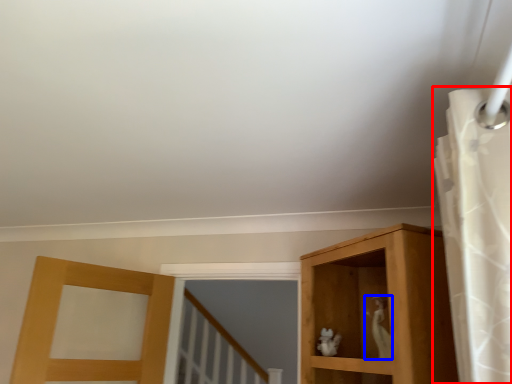
Question: Which object is closer to the camera taking this photo, shower curtain (highlighted by a red box) or animal (highlighted by a blue box)?

Choices:
 (A) shower curtain
 (B) animal

Answer: (A)